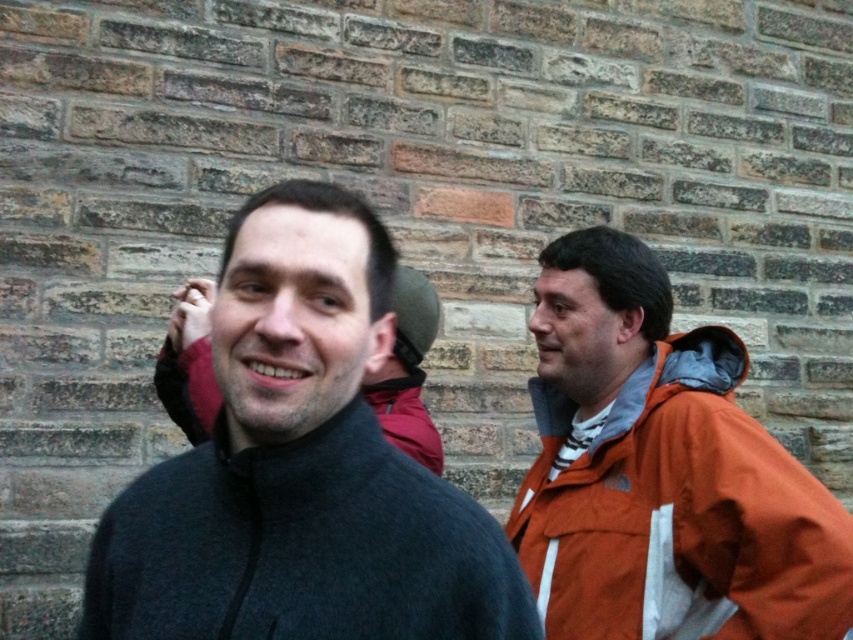
Does dark gray fleece jacket at center appear over orange fabric jacket at right?

Yes, dark gray fleece jacket at center is above orange fabric jacket at right.

Between dark gray fleece jacket at center and orange fabric jacket at right, which one appears on the left side from the viewer's perspective?

From the viewer's perspective, dark gray fleece jacket at center appears more on the left side.

Which is in front, point (224, 588) or point (724, 611)?

Positioned in front is point (224, 588).

In order to click on dark gray fleece jacket at center in this screenshot , I will do `click(300, 467)`.